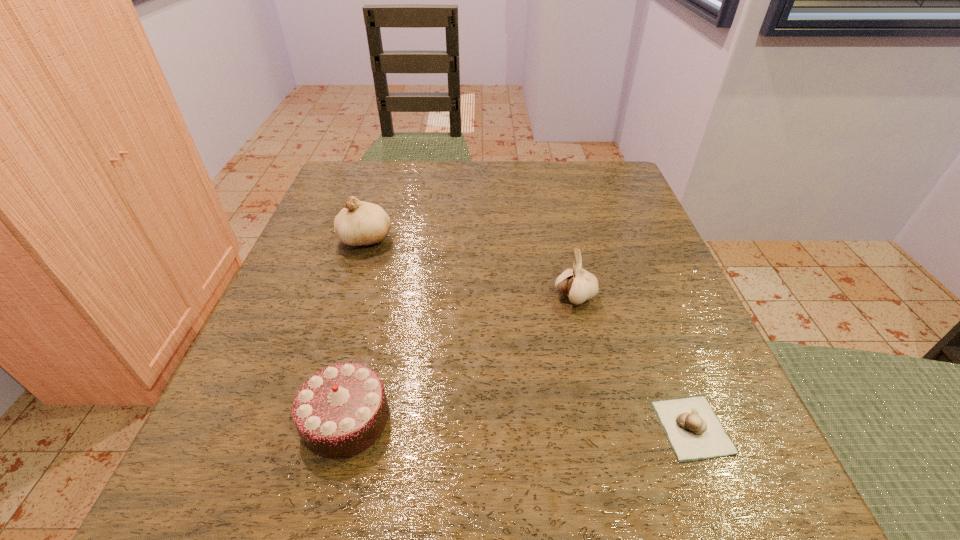
Where is `free space between the third shortest object and the nearest garlic`? The width and height of the screenshot is (960, 540). free space between the third shortest object and the nearest garlic is located at coordinates (634, 362).

Identify the location of vacant space in between the rightmost garlic and the chocolate cake. Image resolution: width=960 pixels, height=540 pixels. (519, 423).

Locate an element on the screen. free spot between the second shortest garlic and the second shortest object is located at coordinates (461, 358).

Find the location of `the closest object relative to the second tallest object`. the closest object relative to the second tallest object is located at coordinates (694, 431).

Locate which object is the second closest to the farthest object. Please provide its 2D coordinates. Your answer should be formatted as a tuple, i.e. [(x, y)], where the tuple contains the x and y coordinates of a point satisfying the conditions above.

[(579, 285)]

Where is `garlic that can be found as the second closest to the farthest garlic`? The width and height of the screenshot is (960, 540). garlic that can be found as the second closest to the farthest garlic is located at coordinates (694, 431).

I want to click on garlic that is the nearest to the second shortest garlic, so click(694, 431).

This screenshot has height=540, width=960. Find the location of `free region that satisfies the following two spatial constraints: 1. on the front side of the third tallest object; 2. on the right side of the nearest garlic`. free region that satisfies the following two spatial constraints: 1. on the front side of the third tallest object; 2. on the right side of the nearest garlic is located at coordinates (344, 427).

Find the location of a particular element. The width and height of the screenshot is (960, 540). free spot that satisfies the following two spatial constraints: 1. on the front side of the rightmost garlic; 2. on the left side of the leftmost garlic is located at coordinates (305, 427).

The width and height of the screenshot is (960, 540). Identify the location of vacant space that satisfies the following two spatial constraints: 1. on the back side of the second shortest object; 2. on the left side of the second object from right to left. (376, 297).